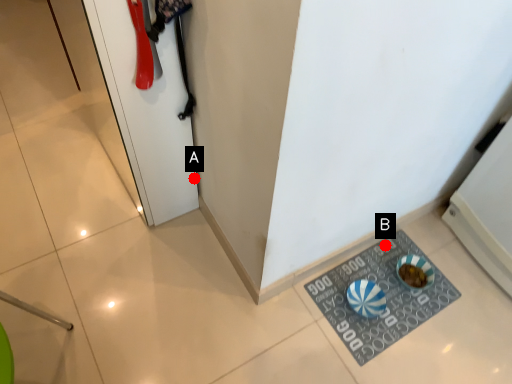
Question: Two points are circled on the image, labeled by A and B beside each circle. Among these points, which one is farthest from the camera?

Choices:
 (A) A is further
 (B) B is further

Answer: (B)